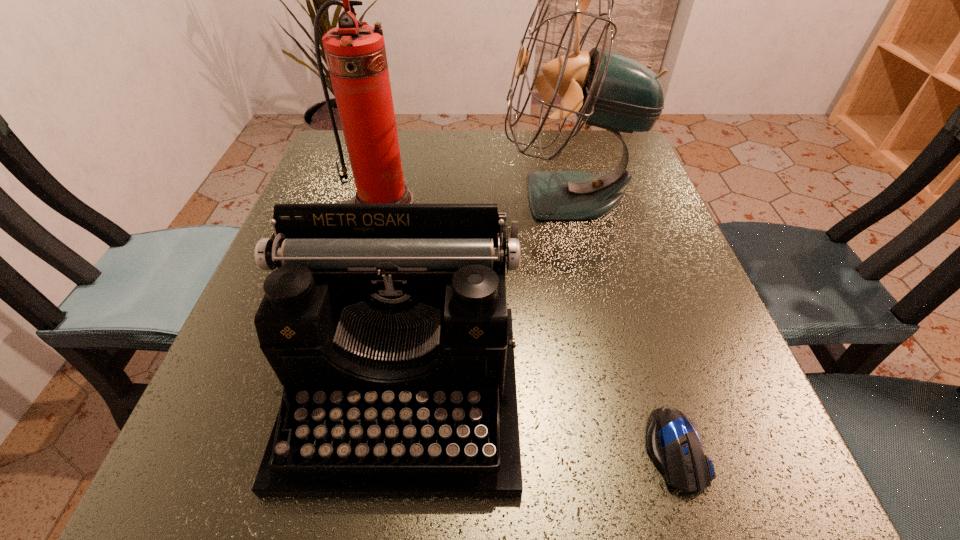
You are a GUI agent. You are given a task and a screenshot of the screen. Output one action in this format:
    pyautogui.click(x=<x>, y=<y>)
    Task: Click on the free location that satisfies the following two spatial constraints: 1. on the front-facing side of the fan for air flow; 2. on the typing side of the third tallest object
    
    Given the screenshot: What is the action you would take?
    pyautogui.click(x=614, y=393)

This screenshot has height=540, width=960. I want to click on vacant area in the image that satisfies the following two spatial constraints: 1. on the front-facing side of the fan for air flow; 2. at the discharge end of the fire extinguisher, so click(x=569, y=202).